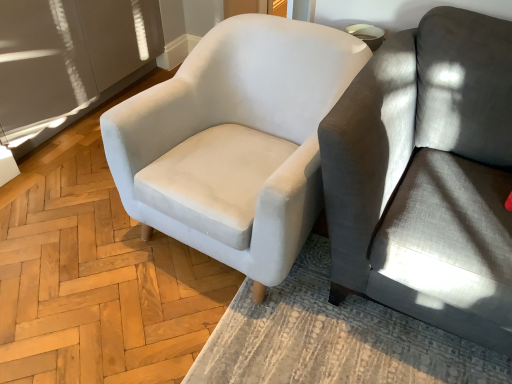
Consider the image. Measure the distance between point (408, 262) and camera.

Point (408, 262) and camera are 1.16 meters apart.

Describe the element at coordinates (428, 176) in the screenshot. The height and width of the screenshot is (384, 512). I see `gray fabric couch at right` at that location.

What are the coordinates of `gray fabric couch at right` in the screenshot? It's located at (428, 176).

Locate an element on the screen. white fabric chair at center is located at coordinates (234, 141).

This screenshot has height=384, width=512. Describe the element at coordinates (234, 141) in the screenshot. I see `white fabric chair at center` at that location.

Identify the location of gray fabric couch at right. The height and width of the screenshot is (384, 512). (428, 176).

Considering the positions of objects white fabric chair at center and gray fabric couch at right in the image provided, who is more to the right, white fabric chair at center or gray fabric couch at right?

gray fabric couch at right is more to the right.

Is the position of white fabric chair at center less distant than that of gray fabric couch at right?

No, it is not.

Is point (220, 38) less distant than point (353, 190)?

No, it is not.

From the image's perspective, between white fabric chair at center and gray fabric couch at right, which one is located above?

white fabric chair at center.

From a real-world perspective, is white fabric chair at center under gray fabric couch at right?

Correct, in the physical world, white fabric chair at center is lower than gray fabric couch at right.

Considering the relative sizes of white fabric chair at center and gray fabric couch at right in the image provided, is white fabric chair at center wider than gray fabric couch at right?

No, white fabric chair at center is not wider than gray fabric couch at right.

Does white fabric chair at center have a lesser height compared to gray fabric couch at right?

Yes, white fabric chair at center is shorter than gray fabric couch at right.

In the scene shown: Between white fabric chair at center and gray fabric couch at right, which one has larger size?

With larger size is gray fabric couch at right.

Is gray fabric couch at right surrounded by white fabric chair at center?

Actually, gray fabric couch at right is outside white fabric chair at center.

Is white fabric chair at center not near gray fabric couch at right?

white fabric chair at center is actually quite close to gray fabric couch at right.

Is white fabric chair at center facing towards gray fabric couch at right?

No, white fabric chair at center does not turn towards gray fabric couch at right.

Can you tell me how much white fabric chair at center and gray fabric couch at right differ in facing direction?

The angular difference between white fabric chair at center and gray fabric couch at right is 4.47 degrees.

Measure the distance between white fabric chair at center and gray fabric couch at right.

white fabric chair at center is 15.39 inches from gray fabric couch at right.

Find the location of a particular element. This screenshot has height=384, width=512. chair below the gray fabric couch at right (from a real-world perspective) is located at coordinates (x=234, y=141).

Between gray fabric couch at right and white fabric chair at center, which one appears on the right side from the viewer's perspective?

gray fabric couch at right is more to the right.

Which is behind, gray fabric couch at right or white fabric chair at center?

white fabric chair at center is further away from the camera.

Considering the positions of point (396, 252) and point (205, 220), is point (396, 252) closer or farther from the camera than point (205, 220)?

Point (396, 252) is positioned closer to the camera compared to point (205, 220).

From the image's perspective, is gray fabric couch at right positioned above or below white fabric chair at center?

Based on their image positions, gray fabric couch at right is located beneath white fabric chair at center.

From a real-world perspective, is gray fabric couch at right on top of white fabric chair at center?

Yes, from a real-world perspective, gray fabric couch at right is on top of white fabric chair at center.

Consider the image. Which of these two, gray fabric couch at right or white fabric chair at center, is wider?

gray fabric couch at right.

In terms of height, does gray fabric couch at right look taller or shorter compared to white fabric chair at center?

gray fabric couch at right is taller than white fabric chair at center.

Based on their sizes in the image, would you say gray fabric couch at right is bigger or smaller than white fabric chair at center?

Clearly, gray fabric couch at right is larger in size than white fabric chair at center.

Is gray fabric couch at right completely or partially outside of white fabric chair at center?

gray fabric couch at right is positioned outside white fabric chair at center.

Are gray fabric couch at right and white fabric chair at center beside each other?

gray fabric couch at right and white fabric chair at center are not in contact.

Is gray fabric couch at right facing away from white fabric chair at center?

No, gray fabric couch at right's orientation is not away from white fabric chair at center.

Can you tell me how much gray fabric couch at right and white fabric chair at center differ in facing direction?

The angular difference between gray fabric couch at right and white fabric chair at center is 4.47 degrees.

Where is `chair on the left of gray fabric couch at right`? chair on the left of gray fabric couch at right is located at coordinates (234, 141).

What are the coordinates of `studio couch lying below the white fabric chair at center (from the image's perspective)` in the screenshot? It's located at (428, 176).

This screenshot has height=384, width=512. Find the location of `studio couch that appears in front of the white fabric chair at center`. studio couch that appears in front of the white fabric chair at center is located at coordinates (428, 176).